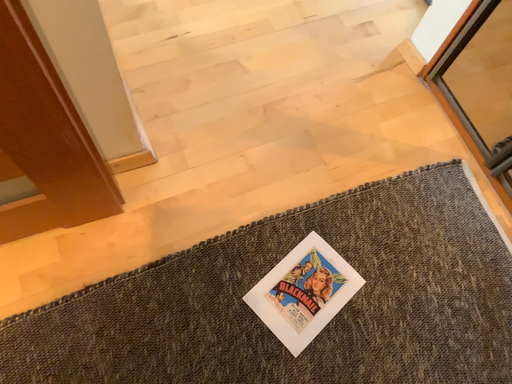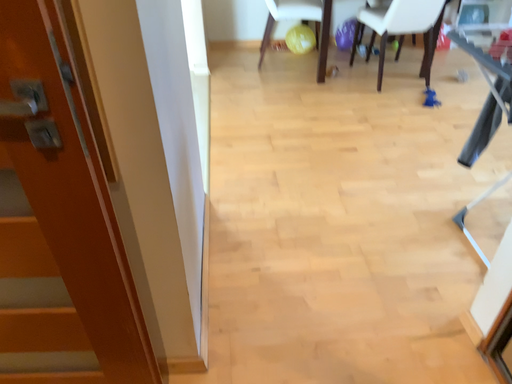
Question: Which way did the camera rotate in the video?

Choices:
 (A) rotated right
 (B) rotated left

Answer: (B)